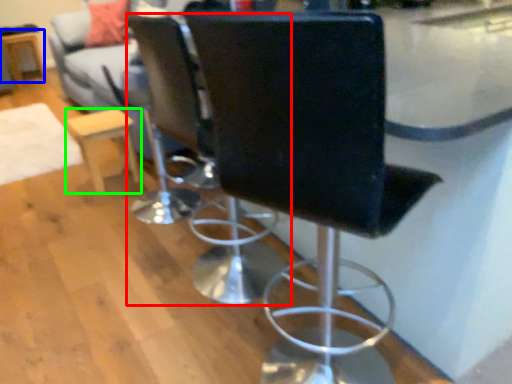
Question: Which object is positioned closest to chair (highlighted by a red box)? Select from round table (highlighted by a blue box) and furniture (highlighted by a green box).

Choices:
 (A) round table
 (B) furniture

Answer: (B)